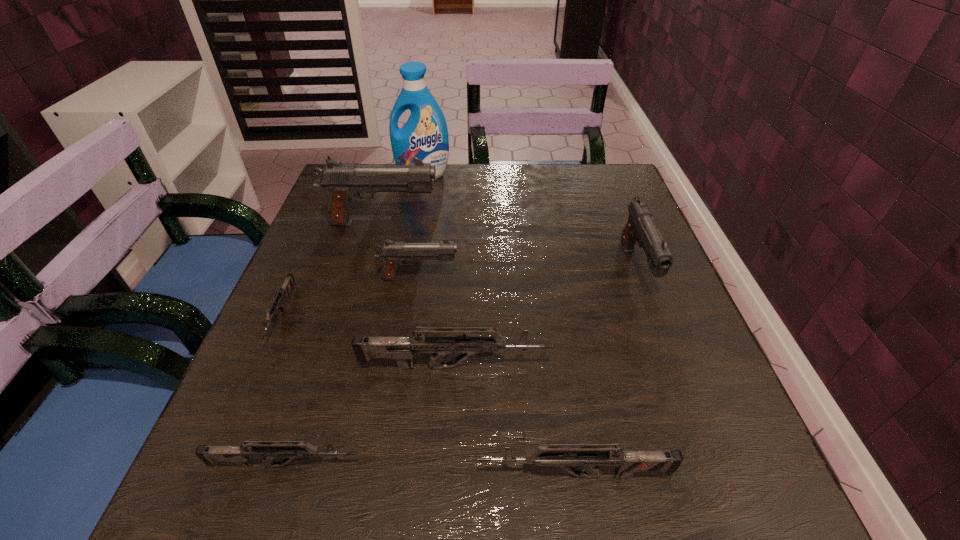
Where is `the tallest object`? The width and height of the screenshot is (960, 540). the tallest object is located at coordinates (425, 136).

Identify the location of detergent. (425, 136).

This screenshot has height=540, width=960. What are the coordinates of `the tallest gun` in the screenshot? It's located at (343, 182).

Image resolution: width=960 pixels, height=540 pixels. I want to click on the biggest gray gun, so click(343, 182).

At what (x,y) coordinates should I click in order to perform the action: click on the rightmost gun. Please return your answer as a coordinate pair (x, y). This screenshot has height=540, width=960. Looking at the image, I should click on (640, 227).

What are the coordinates of `the rightmost gray gun` in the screenshot? It's located at (640, 227).

Where is `the smallest gray gun`? The width and height of the screenshot is (960, 540). the smallest gray gun is located at coordinates (392, 253).

This screenshot has height=540, width=960. I want to click on the fifth farthest gun, so click(402, 349).

Find the location of `the third nearest grey gun`. the third nearest grey gun is located at coordinates (402, 349).

Locate an element on the screen. the second biggest grey gun is located at coordinates (564, 457).